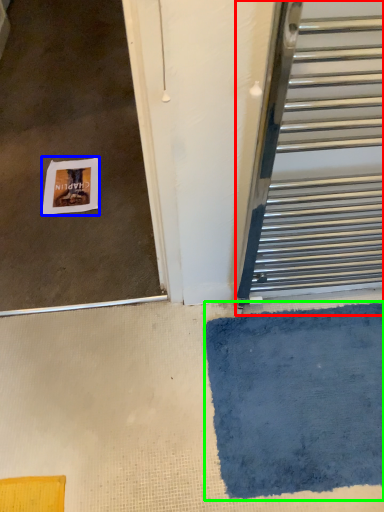
Question: Considering the real-world distances, which object is farthest from door (highlighted by a red box)? postcard (highlighted by a blue box) or bath mat (highlighted by a green box)?

Choices:
 (A) postcard
 (B) bath mat

Answer: (A)